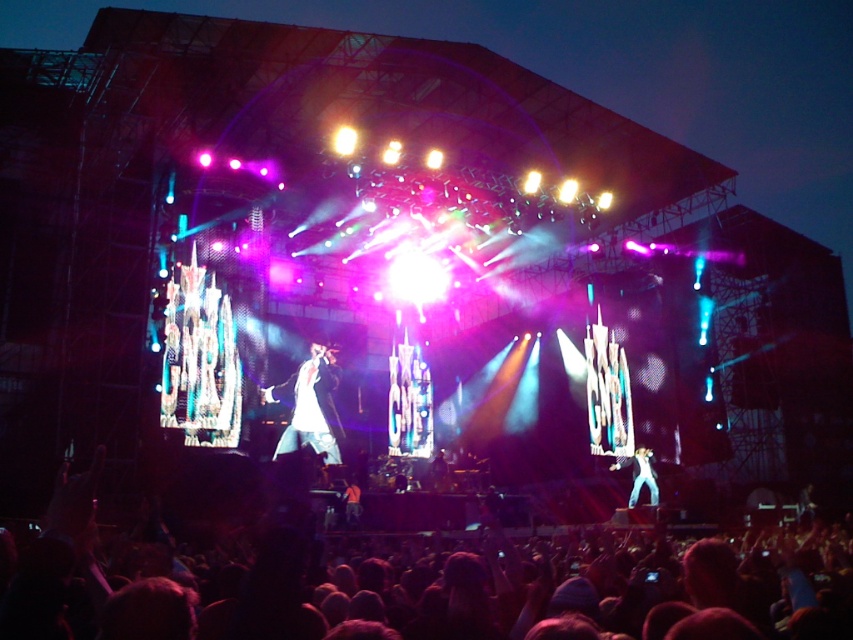
You are a photographer at the back of the venue and want to capture both the white glossy suit at center and the white cotton shirt at center in a single photo. Given that your camera has a limited depth of field, which performer should you focus on to ensure the other remains in the background?

You should focus on the white glossy suit at center because it is taller than the white cotton shirt at center, so the shorter one will naturally be in the background if the taller one is in focus.

You are a photographer at the concert and want to capture a clear shot of both the white glossy suit at center and the white cotton shirt at center. However, you notice that one of them is blocking the other. Which one is covering part of the other?

The white glossy suit at center is positioned over white cotton shirt at center, so it is covering part of the white cotton shirt at center.